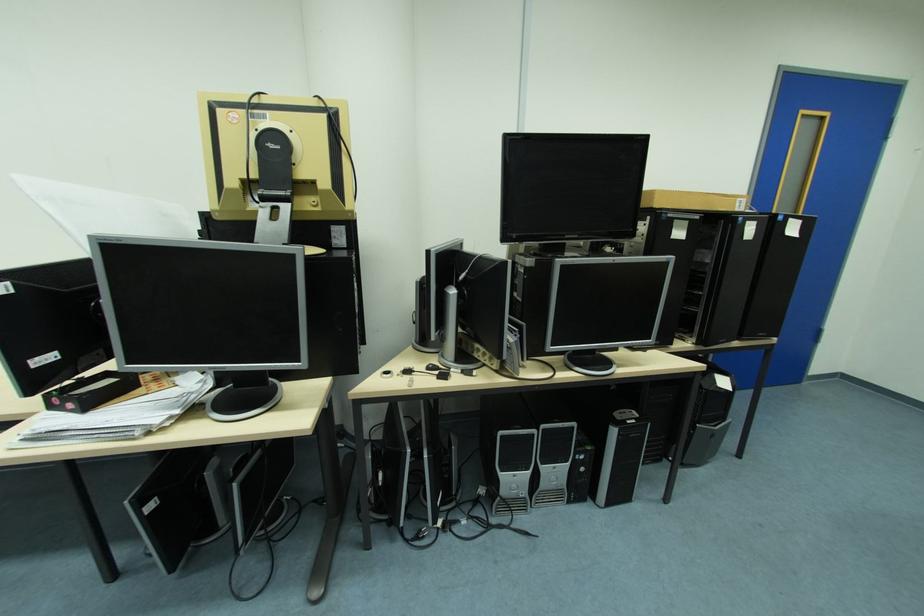
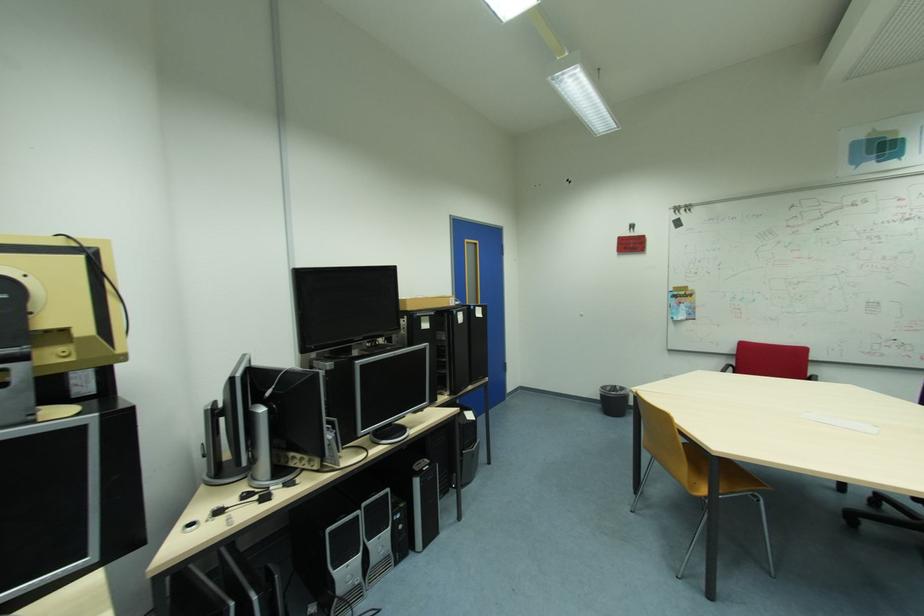
Locate, in the second image, the point that corresponds to [811,113] in the first image.

(473, 241)